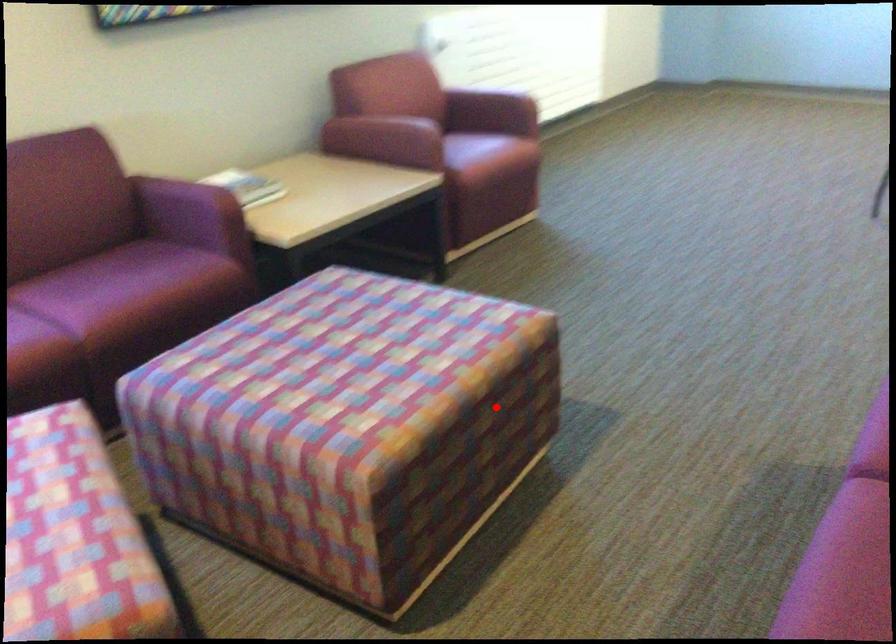
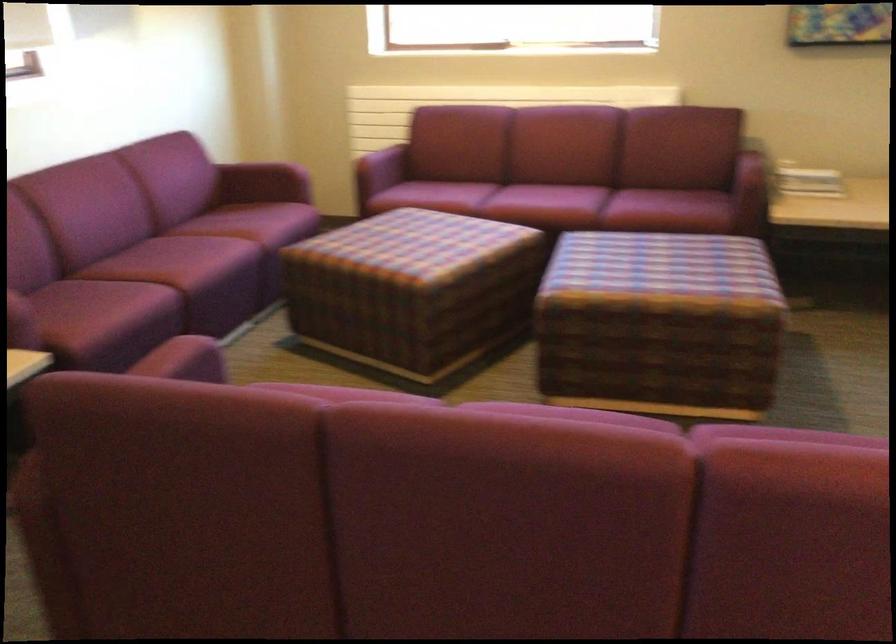
Question: I am providing you with two images of the same scene from different viewpoints. Image1 has a red point marked. In image2, the corresponding 3D location appears at what relative position? Reply with the corresponding letter.

Choices:
 (A) Closer
 (B) Farther

Answer: (B)